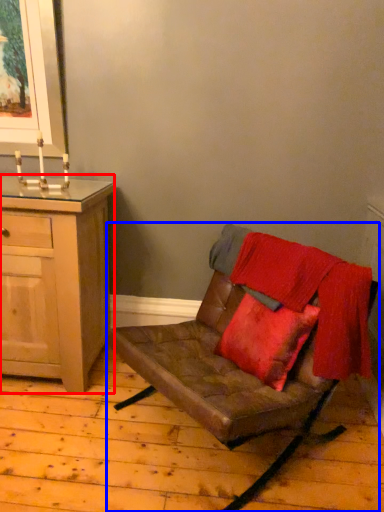
Question: Which point is closer to the camera, cabinetry (highlighted by a red box) or chair (highlighted by a blue box)?

Choices:
 (A) cabinetry
 (B) chair

Answer: (B)